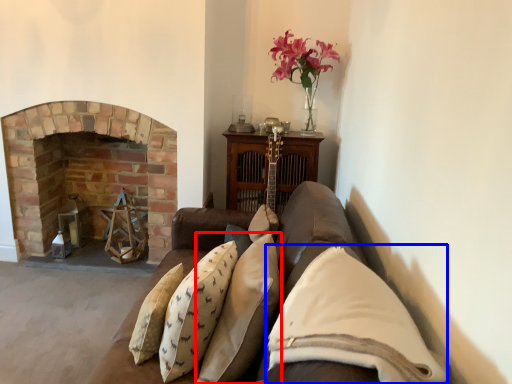
Question: Among these objects, which one is farthest to the camera, pillow (highlighted by a red box) or pillow (highlighted by a blue box)?

Choices:
 (A) pillow
 (B) pillow

Answer: (A)